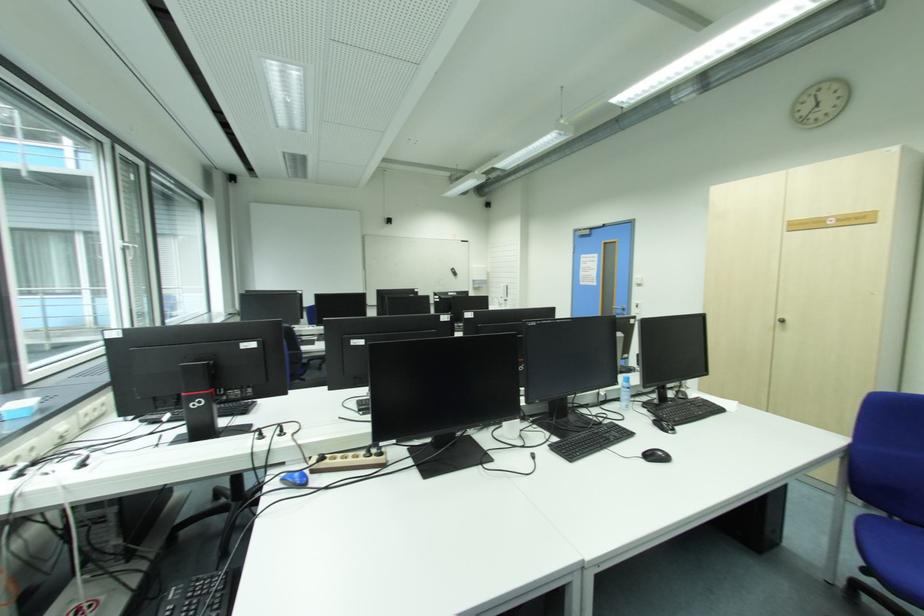
What do you see at coordinates (892, 554) in the screenshot? This screenshot has width=924, height=616. I see `the blue chair sitting surface` at bounding box center [892, 554].